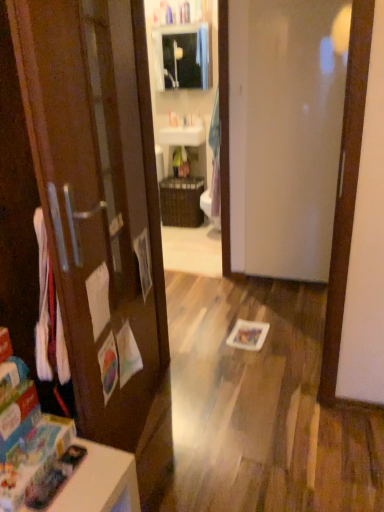
Question: Considering the relative sizes of white glossy sink at upper center and white glossy table at lower left in the image provided, is white glossy sink at upper center wider than white glossy table at lower left?

Choices:
 (A) no
 (B) yes

Answer: (A)

Question: Can you confirm if white glossy sink at upper center is bigger than white glossy table at lower left?

Choices:
 (A) yes
 (B) no

Answer: (B)

Question: Considering the relative sizes of white glossy sink at upper center and white glossy table at lower left in the image provided, is white glossy sink at upper center smaller than white glossy table at lower left?

Choices:
 (A) no
 (B) yes

Answer: (B)

Question: Could you tell me if white glossy sink at upper center is turned towards white glossy table at lower left?

Choices:
 (A) yes
 (B) no

Answer: (A)

Question: Is the depth of white glossy sink at upper center less than that of white glossy table at lower left?

Choices:
 (A) yes
 (B) no

Answer: (B)

Question: Is white glossy table at lower left inside white glossy sink at upper center?

Choices:
 (A) yes
 (B) no

Answer: (B)

Question: Considering the relative sizes of white glossy table at lower left and matte glass medicine cabinet at upper center in the image provided, is white glossy table at lower left taller than matte glass medicine cabinet at upper center?

Choices:
 (A) no
 (B) yes

Answer: (A)

Question: Is white glossy table at lower left wider than matte glass medicine cabinet at upper center?

Choices:
 (A) no
 (B) yes

Answer: (B)

Question: Can you confirm if white glossy table at lower left is shorter than matte glass medicine cabinet at upper center?

Choices:
 (A) yes
 (B) no

Answer: (A)

Question: Can you confirm if white glossy table at lower left is positioned to the right of matte glass medicine cabinet at upper center?

Choices:
 (A) yes
 (B) no

Answer: (B)

Question: From the image's perspective, is white glossy table at lower left below matte glass medicine cabinet at upper center?

Choices:
 (A) yes
 (B) no

Answer: (A)

Question: Is white glossy table at lower left in front of matte glass medicine cabinet at upper center?

Choices:
 (A) yes
 (B) no

Answer: (A)

Question: Are white glossy table at lower left and white glossy door at center making contact?

Choices:
 (A) no
 (B) yes

Answer: (A)